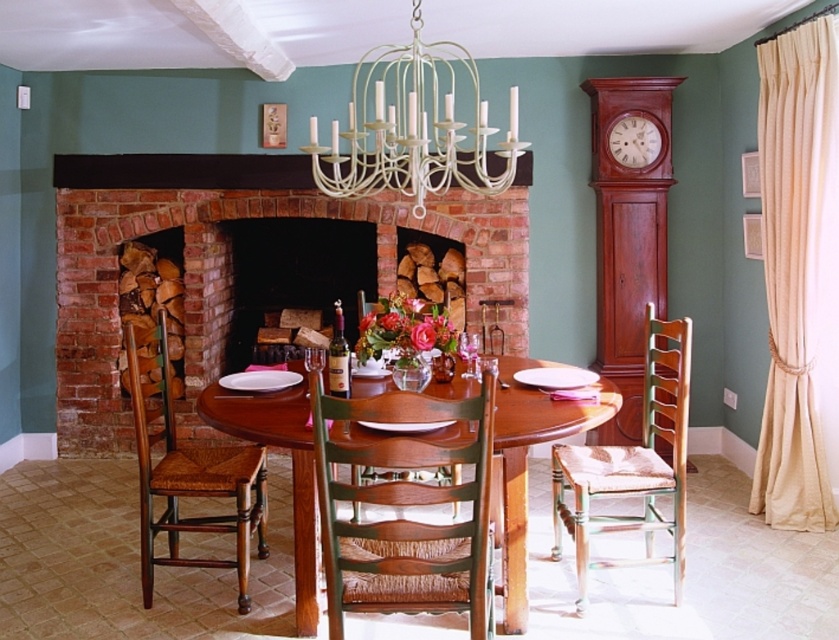
Question: Estimate the real-world distances between objects in this image. Which object is closer to the wooden grandfather clock at right?

Choices:
 (A) brown wooden clock at right
 (B) green woven chair at center

Answer: (A)

Question: Does green painted wood chair at right appear over wooden grandfather clock at right?

Choices:
 (A) yes
 (B) no

Answer: (B)

Question: Does brick fireplace at center appear under green woven chair at center?

Choices:
 (A) yes
 (B) no

Answer: (B)

Question: In this image, where is green woven chair at center located relative to wooden grandfather clock at right?

Choices:
 (A) left
 (B) right

Answer: (A)

Question: Estimate the real-world distances between objects in this image. Which object is closer to the brick fireplace at center?

Choices:
 (A) white matte chandelier at upper center
 (B) mahogany wood table at center
 (C) green painted wood chair at right
 (D) brown woven wood chair at center

Answer: (A)

Question: Estimate the real-world distances between objects in this image. Which object is farther from the wooden grandfather clock at right?

Choices:
 (A) brown woven wood chair at center
 (B) brown wooden clock at right
 (C) green painted wood chair at right

Answer: (A)